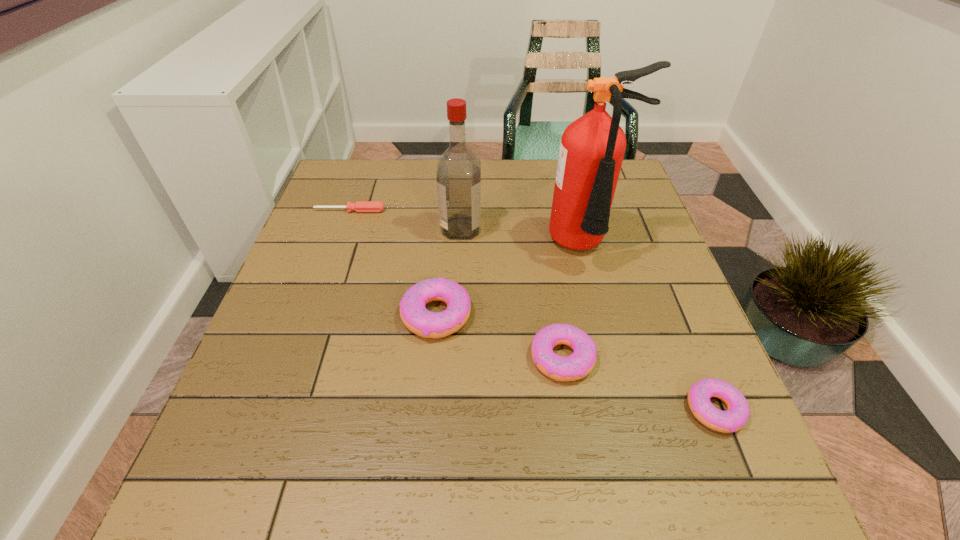
Locate an element on the screen. This screenshot has height=540, width=960. free space between the second tallest doughnut and the liquor is located at coordinates (512, 293).

Identify the location of free spot between the shortest object and the rightmost object. (532, 310).

You are a GUI agent. You are given a task and a screenshot of the screen. Output one action in this format:
    pyautogui.click(x=<x>, y=<y>)
    Task: Click on the free space between the leftmost doughnut and the fire extinguisher
    The width and height of the screenshot is (960, 540).
    Given the screenshot: What is the action you would take?
    pyautogui.click(x=511, y=281)

Locate an element on the screen. The width and height of the screenshot is (960, 540). object that is the fifth nearest to the leftmost object is located at coordinates (737, 414).

Identify which object is located as the second nearest to the third tallest object. Please provide its 2D coordinates. Your answer should be formatted as a tuple, i.e. [(x, y)], where the tuple contains the x and y coordinates of a point satisfying the conditions above.

[(458, 176)]

At what (x,y) coordinates should I click in order to perform the action: click on doughnut object that ranks as the second closest to the second shortest object. Please return your answer as a coordinate pair (x, y). Image resolution: width=960 pixels, height=540 pixels. Looking at the image, I should click on (413, 312).

Where is `doughnut that is the second closest to the tallest doughnut`? Image resolution: width=960 pixels, height=540 pixels. doughnut that is the second closest to the tallest doughnut is located at coordinates (737, 414).

Locate an element on the screen. This screenshot has width=960, height=540. vacant area that satisfies the following two spatial constraints: 1. on the front-facing side of the second tallest object; 2. on the right side of the shortest doughnut is located at coordinates (452, 410).

Find the location of a particular element. blank space that satisfies the following two spatial constraints: 1. on the front-facing side of the rightmost object; 2. on the left side of the liquor is located at coordinates (452, 410).

Find the location of `free location that satisfies the following two spatial constraints: 1. on the front side of the leftmost doughnut; 2. on the left side of the second shortest object`. free location that satisfies the following two spatial constraints: 1. on the front side of the leftmost doughnut; 2. on the left side of the second shortest object is located at coordinates (427, 410).